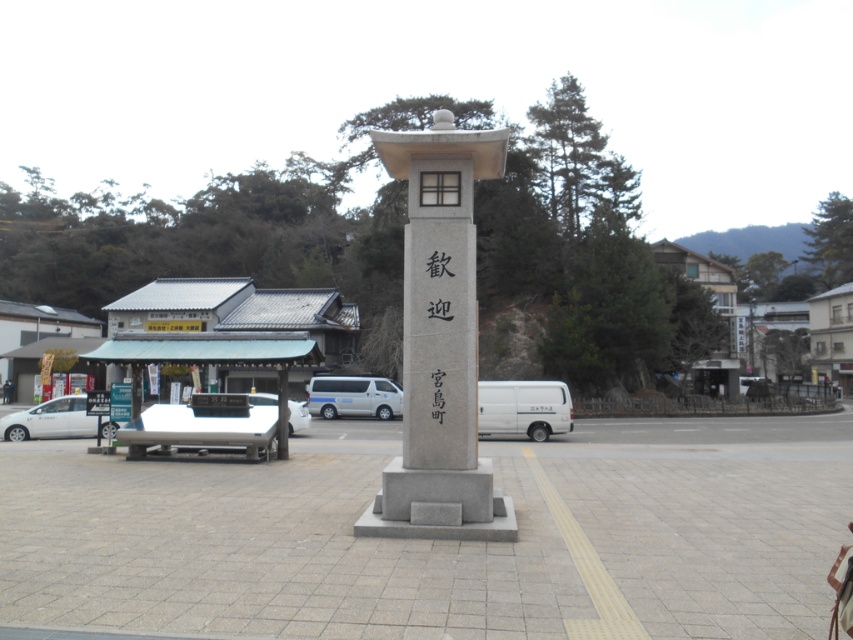
Does gray stone monument at center have a greater height compared to white glossy van at center?

Indeed, gray stone monument at center has a greater height compared to white glossy van at center.

Can you confirm if gray stone monument at center is shorter than white glossy van at center?

No, gray stone monument at center is not shorter than white glossy van at center.

Is point (461, 285) behind point (271, 401)?

No, (461, 285) is in front of (271, 401).

At what (x,y) coordinates should I click in order to perform the action: click on gray stone monument at center. Please return your answer as a coordinate pair (x, y). The image size is (853, 640). Looking at the image, I should click on (439, 340).

Is white matte van at center thinner than white glossy van at center?

Correct, white matte van at center's width is less than white glossy van at center's.

Does white matte van at center appear under white glossy van at center?

Correct, white matte van at center is located below white glossy van at center.

Is point (384, 396) farther from camera compared to point (270, 404)?

That is True.

At what (x,y) coordinates should I click in order to perform the action: click on white matte van at center. Please return your answer as a coordinate pair (x, y). The height and width of the screenshot is (640, 853). Looking at the image, I should click on (352, 396).

Who is positioned more to the left, gray stone monument at center or black stone writing at center?

From the viewer's perspective, gray stone monument at center appears more on the left side.

Does gray stone monument at center appear over black stone writing at center?

No, gray stone monument at center is not above black stone writing at center.

Is point (450, 465) more distant than point (442, 372)?

No, it is in front of (442, 372).

Where is `gray stone monument at center`? The height and width of the screenshot is (640, 853). gray stone monument at center is located at coordinates (439, 340).